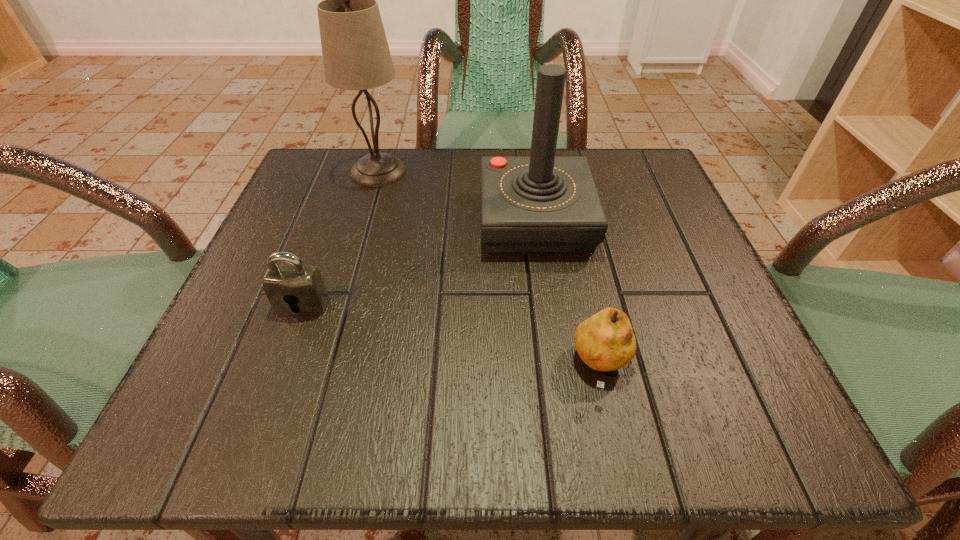
Find the location of a particular element. the farthest object is located at coordinates (356, 56).

The image size is (960, 540). In order to click on lampshade in this screenshot , I will do `click(356, 56)`.

The image size is (960, 540). What are the coordinates of `joystick` in the screenshot? It's located at (542, 204).

This screenshot has width=960, height=540. I want to click on the third shortest object, so pyautogui.click(x=542, y=204).

In order to click on the second nearest object in this screenshot , I will do `click(302, 286)`.

Locate an element on the screen. The image size is (960, 540). the nearest object is located at coordinates (605, 342).

Locate an element on the screen. free space located 0.190m on the front-facing side of the lampshade is located at coordinates (498, 171).

Image resolution: width=960 pixels, height=540 pixels. What are the coordinates of `free location located on the rectangular base of the third shortest object` in the screenshot? It's located at (549, 318).

Where is `free spot located 0.070m at the front of the second nearest object near the keyhole`? free spot located 0.070m at the front of the second nearest object near the keyhole is located at coordinates (284, 356).

Find the location of a particular element. The width and height of the screenshot is (960, 540). free location located 0.350m on the back of the nearest object is located at coordinates (563, 193).